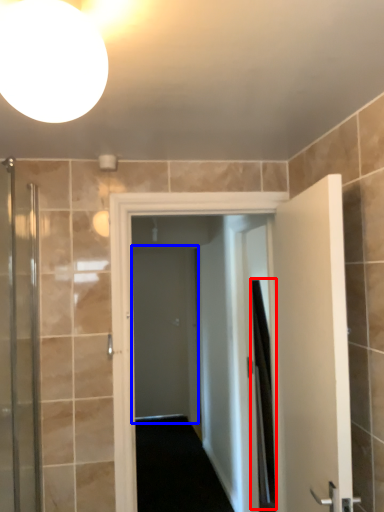
Question: Which of the following is the closest to the observer, shower curtain (highlighted by a red box) or screen door (highlighted by a blue box)?

Choices:
 (A) shower curtain
 (B) screen door

Answer: (A)